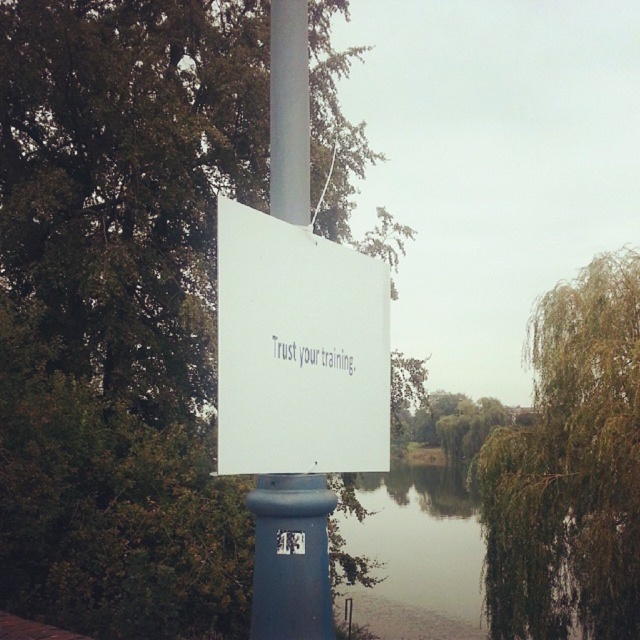
You are an artist sketching the scene. You want to ensure the white plastic sign at center and the green leafy tree at center are proportionally accurate. Which object should you draw smaller?

The white plastic sign at center should be drawn smaller because it occupies less space than the green leafy tree at center according to the description.

In the scene shown: You are standing at the center of the image and want to find the green leafy tree at upper left. In which direction should you look?

The green leafy tree at upper left is located at point (122,308), so you should look towards the upper left direction to find it.

You are standing in front of the sign mounted on a blue pole near the water. You want to take a photo of the sign with the green leafy tree at right in the background. Is the tree positioned to the right of the sign?

Yes, the green leafy tree at right is positioned to the right of the sign mounted on a blue pole.